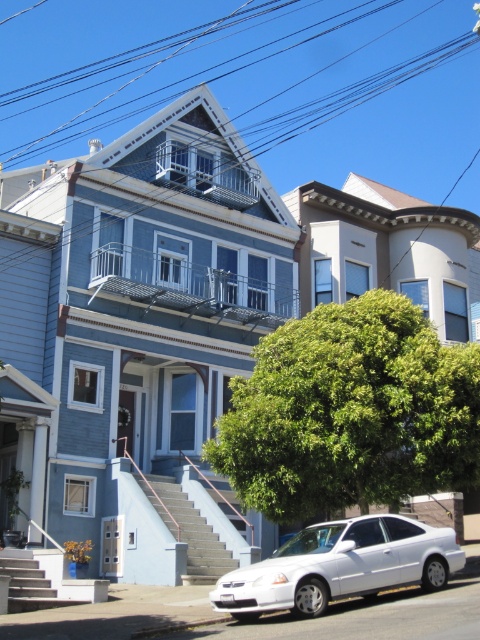
Question: Among these points, which one is farthest from the camera?

Choices:
 (A) (7, 556)
 (B) (192, 582)
 (C) (446, 573)

Answer: (B)

Question: Can you confirm if black wire at upper center is positioned above green leafy tree at center?

Choices:
 (A) no
 (B) yes

Answer: (B)

Question: Is concrete stairs at center to the right of smooth concrete stairs at lower left from the viewer's perspective?

Choices:
 (A) yes
 (B) no

Answer: (A)

Question: Which object is the closest to the black wire at upper center?

Choices:
 (A) concrete stairs at center
 (B) green leafy tree at center
 (C) white glossy sedan at center
 (D) smooth concrete stairs at lower left

Answer: (B)

Question: Does green leafy tree at center appear on the right side of white glossy sedan at center?

Choices:
 (A) yes
 (B) no

Answer: (B)

Question: Which is farther from the white glossy sedan at center?

Choices:
 (A) black wire at upper center
 (B) green leafy tree at center
 (C) concrete stairs at center

Answer: (A)